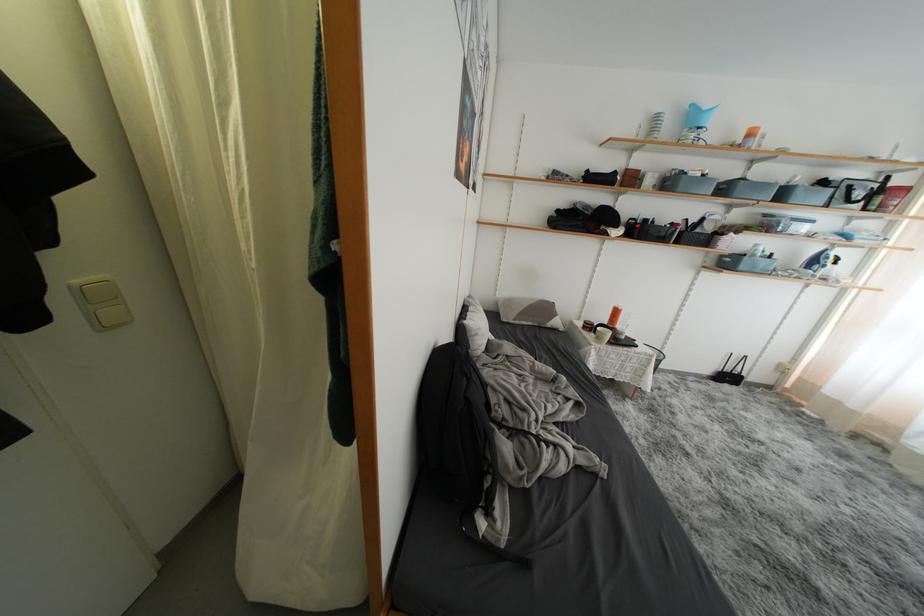
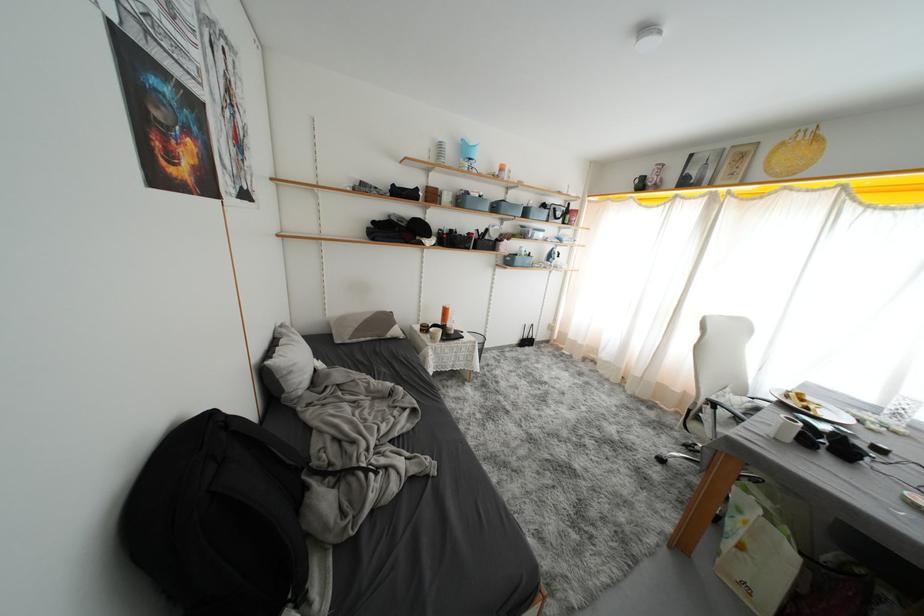
Question: The images are taken continuously from a first-person perspective. In which direction is your viewpoint rotating?

Choices:
 (A) Left
 (B) Right
 (C) Up
 (D) Down

Answer: (B)